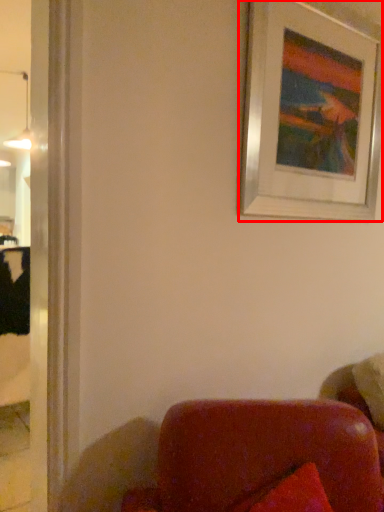
Question: Observing the image, what is the correct spatial positioning of picture frame (annotated by the red box) in reference to lamp?

Choices:
 (A) left
 (B) right

Answer: (B)